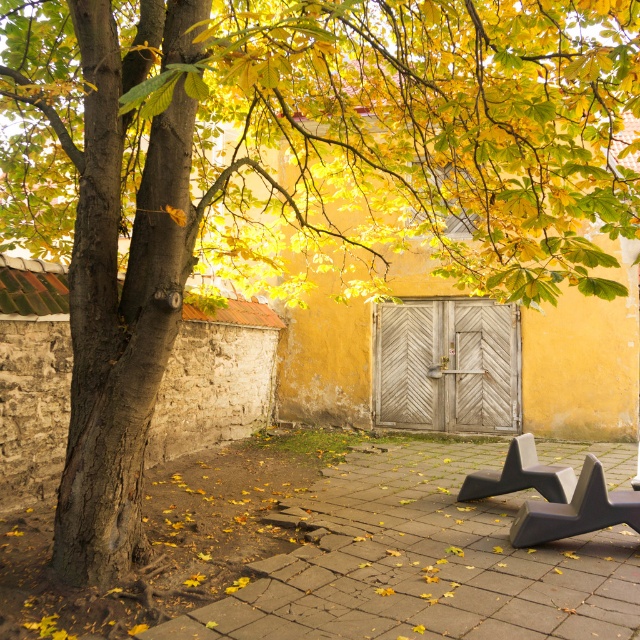
Measure the distance between smooth concrete bench at lower right and camera.

The distance of smooth concrete bench at lower right from camera is 4.37 meters.

What do you see at coordinates (420, 563) in the screenshot? I see `smooth concrete bench at lower right` at bounding box center [420, 563].

Locate an element on the screen. smooth concrete bench at lower right is located at coordinates (420, 563).